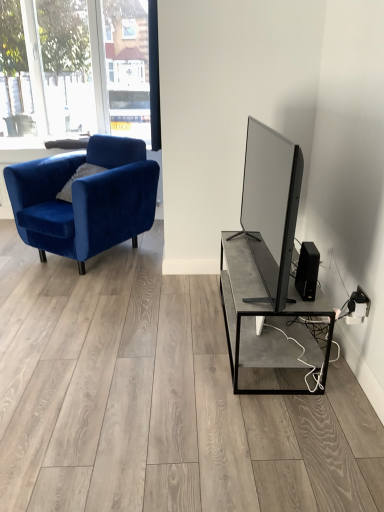
The width and height of the screenshot is (384, 512). I want to click on vacant area that is in front of velvet blue armchair at left, so click(x=77, y=296).